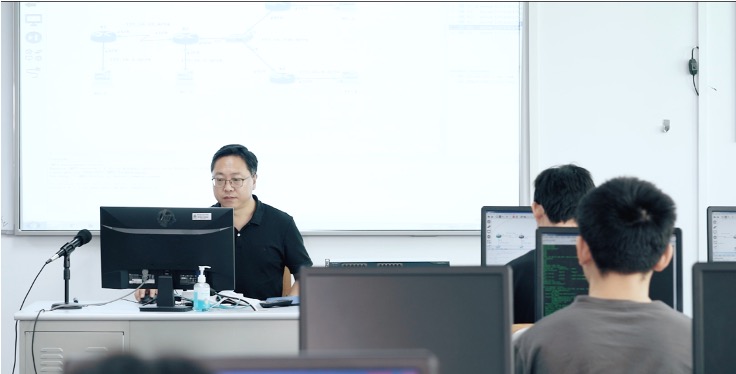
Find the location of a particular element. The image size is (736, 374). white desk is located at coordinates (230, 330).